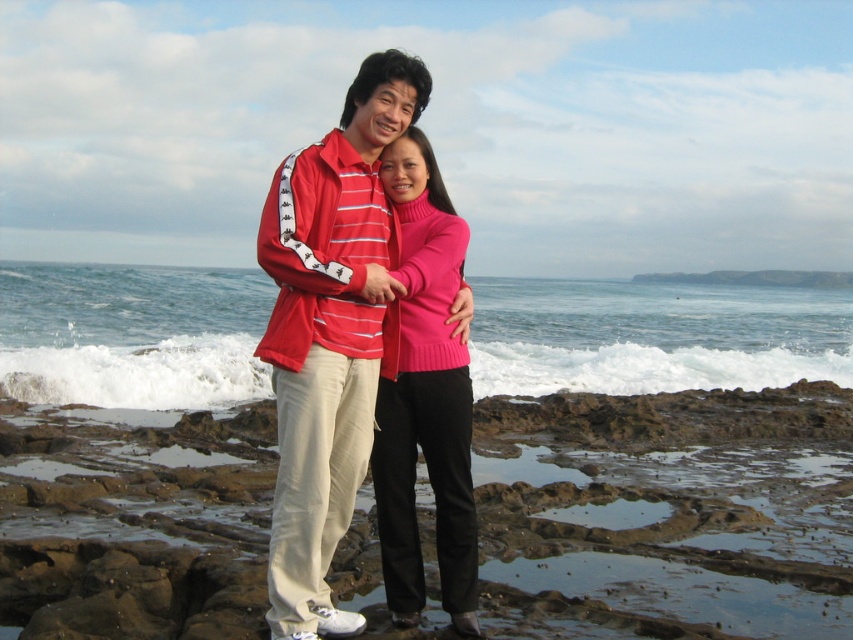
Is brown rocky coast at center smaller than matte red jacket at center?

Incorrect, brown rocky coast at center is not smaller in size than matte red jacket at center.

Based on the photo, does brown rocky coast at center have a lesser height compared to matte red jacket at center?

Correct, brown rocky coast at center is not as tall as matte red jacket at center.

Is point (816, 445) more distant than point (310, 268)?

Yes, it is behind point (310, 268).

You are a GUI agent. You are given a task and a screenshot of the screen. Output one action in this format:
    pyautogui.click(x=<x>, y=<y>)
    Task: Click on the brown rocky coast at center
    Image resolution: width=853 pixels, height=640 pixels.
    Given the screenshot: What is the action you would take?
    pyautogui.click(x=666, y=515)

Does brown rocky coast at center appear over matte pink sweater at center?

No, brown rocky coast at center is not above matte pink sweater at center.

Between point (822, 397) and point (397, 429), which one is positioned in front?

Point (397, 429) is in front.

Identify the location of brown rocky coast at center. (666, 515).

Between matte red jacket at center and matte pink sweater at center, which one is positioned lower?

Positioned lower is matte pink sweater at center.

Based on the photo, does matte red jacket at center appear over matte pink sweater at center?

Indeed, matte red jacket at center is positioned over matte pink sweater at center.

Where is `matte red jacket at center`? matte red jacket at center is located at coordinates (329, 333).